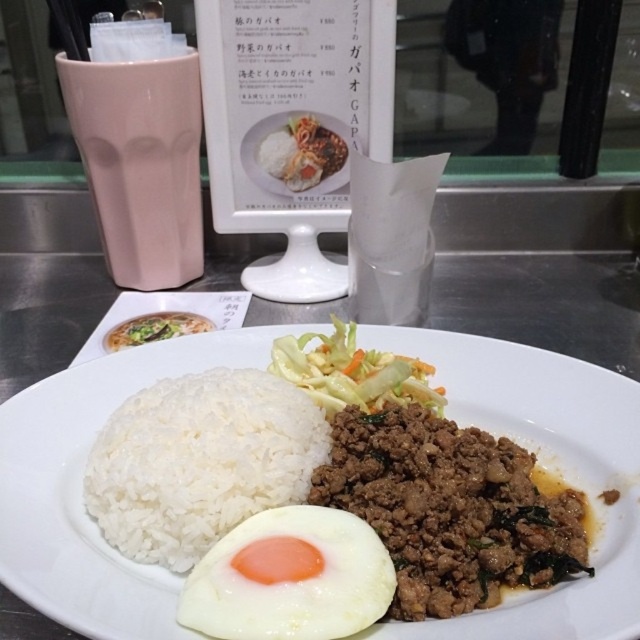
You are a food critic analyzing the composition of the meal. The coordinates provided in the image indicate a specific location. Which food item is located at the coordinates point (545, 465)?

The point (545, 465) corresponds to the white matte rice at center.